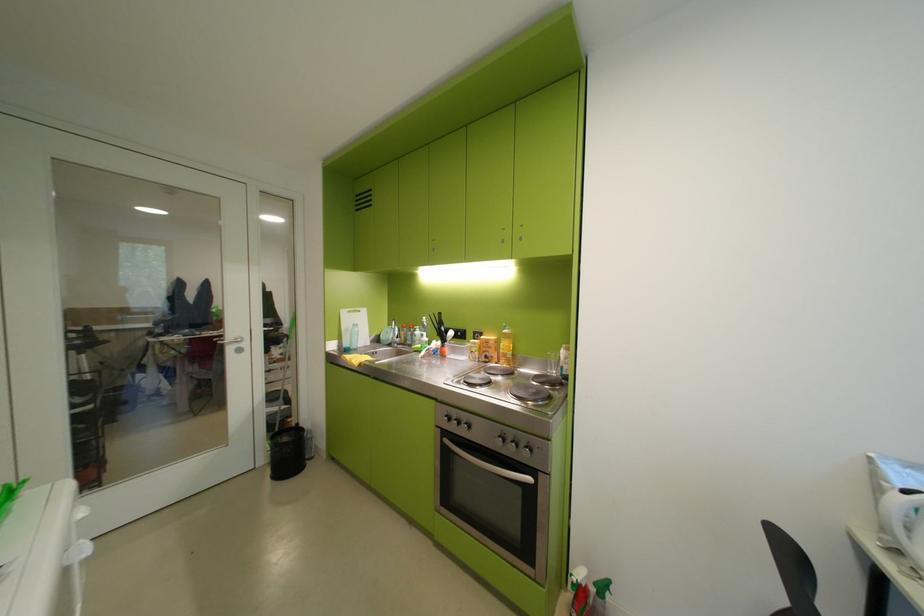
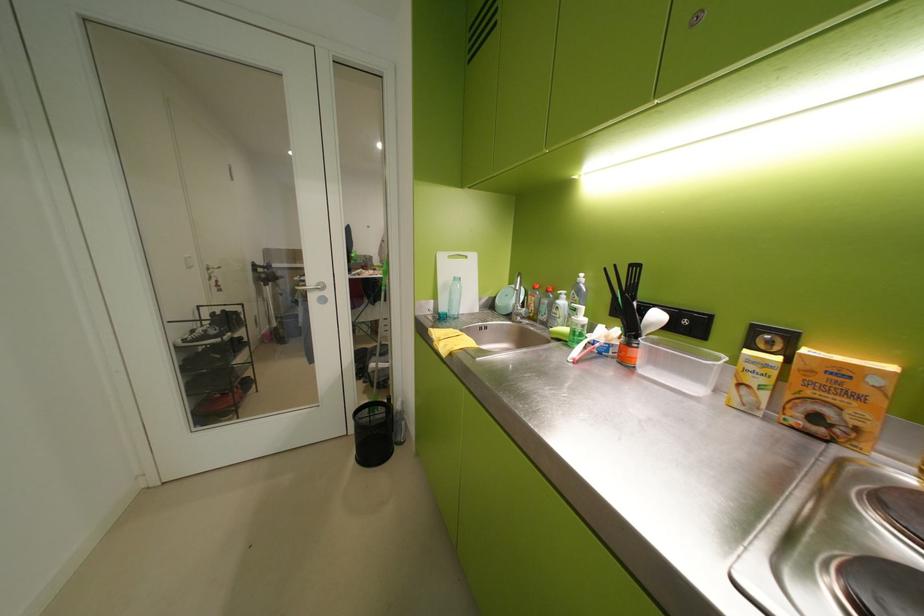
Question: In a continuous first-person perspective shot, in which direction is the camera moving?

Choices:
 (A) Left
 (B) Right
 (C) Forward
 (D) Backward

Answer: (C)